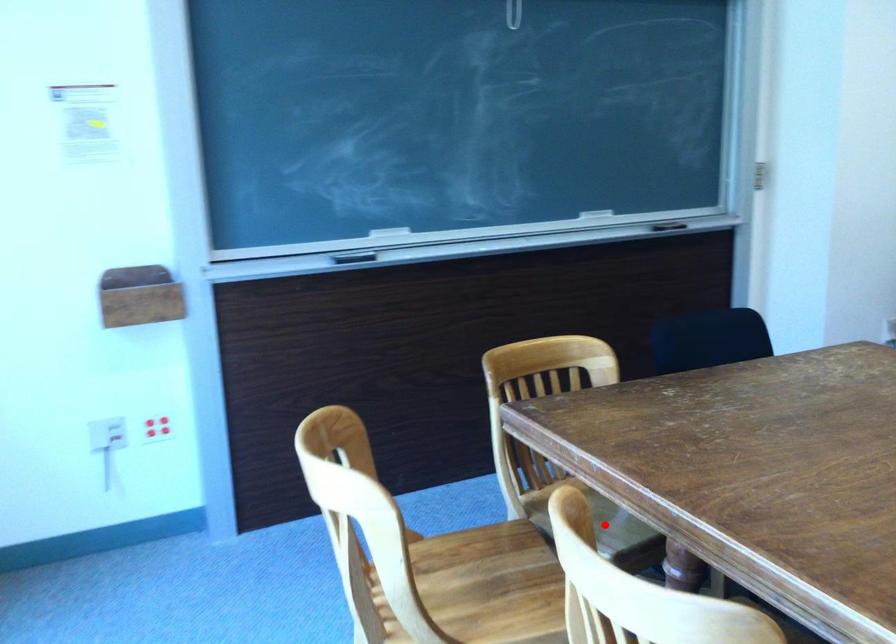
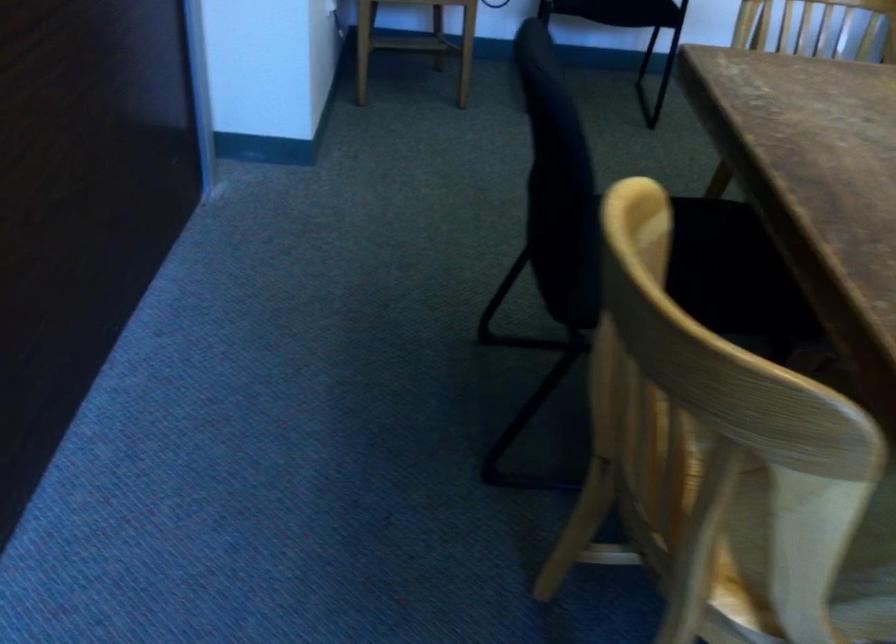
Question: I am providing you with two images of the same scene from different viewpoints. A red point is shown in image1. For the corresponding object point in image2, is it positioned nearer or farther from the camera?

Choices:
 (A) Nearer
 (B) Farther

Answer: (A)